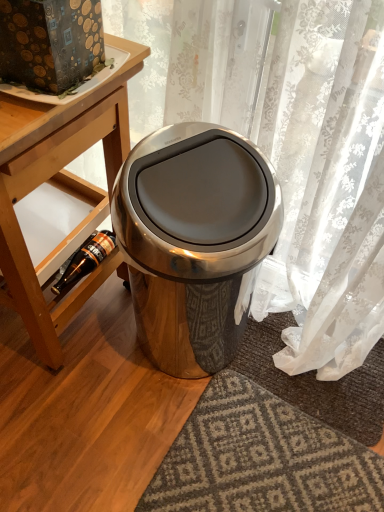
Question: From the image's perspective, is satin metallic trash can at center under wooden table at lower left?

Choices:
 (A) no
 (B) yes

Answer: (B)

Question: Considering the relative sizes of satin metallic trash can at center and wooden table at lower left in the image provided, is satin metallic trash can at center thinner than wooden table at lower left?

Choices:
 (A) yes
 (B) no

Answer: (A)

Question: Does satin metallic trash can at center have a lesser height compared to wooden table at lower left?

Choices:
 (A) no
 (B) yes

Answer: (B)

Question: Is satin metallic trash can at center behind wooden table at lower left?

Choices:
 (A) yes
 (B) no

Answer: (A)

Question: Is satin metallic trash can at center turned away from wooden table at lower left?

Choices:
 (A) yes
 (B) no

Answer: (B)

Question: Is satin metallic trash can at center wider or thinner than wooden table at lower left?

Choices:
 (A) thin
 (B) wide

Answer: (A)

Question: From the image's perspective, is satin metallic trash can at center positioned above or below wooden table at lower left?

Choices:
 (A) above
 (B) below

Answer: (B)

Question: From a real-world perspective, is satin metallic trash can at center positioned above or below wooden table at lower left?

Choices:
 (A) above
 (B) below

Answer: (B)

Question: Is satin metallic trash can at center inside the boundaries of wooden table at lower left, or outside?

Choices:
 (A) outside
 (B) inside

Answer: (A)

Question: Does point (87, 269) appear closer or farther from the camera than point (51, 252)?

Choices:
 (A) farther
 (B) closer

Answer: (A)

Question: Relative to wooden shelf at lower left, is brown glass bottle at lower left in front or behind?

Choices:
 (A) front
 (B) behind

Answer: (B)

Question: From the image's perspective, is brown glass bottle at lower left positioned above or below wooden shelf at lower left?

Choices:
 (A) below
 (B) above

Answer: (A)

Question: From a real-world perspective, is brown glass bottle at lower left physically located above or below wooden shelf at lower left?

Choices:
 (A) below
 (B) above

Answer: (A)

Question: Looking at their shapes, would you say wooden shelf at lower left is wider or thinner than satin metallic trash can at center?

Choices:
 (A) thin
 (B) wide

Answer: (B)

Question: Relative to satin metallic trash can at center, is wooden shelf at lower left in front or behind?

Choices:
 (A) front
 (B) behind

Answer: (B)